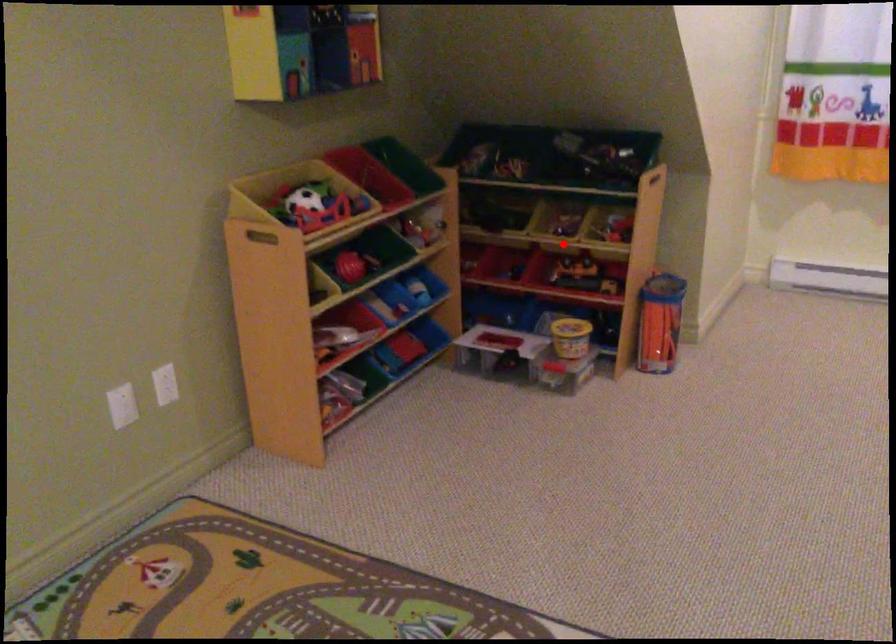
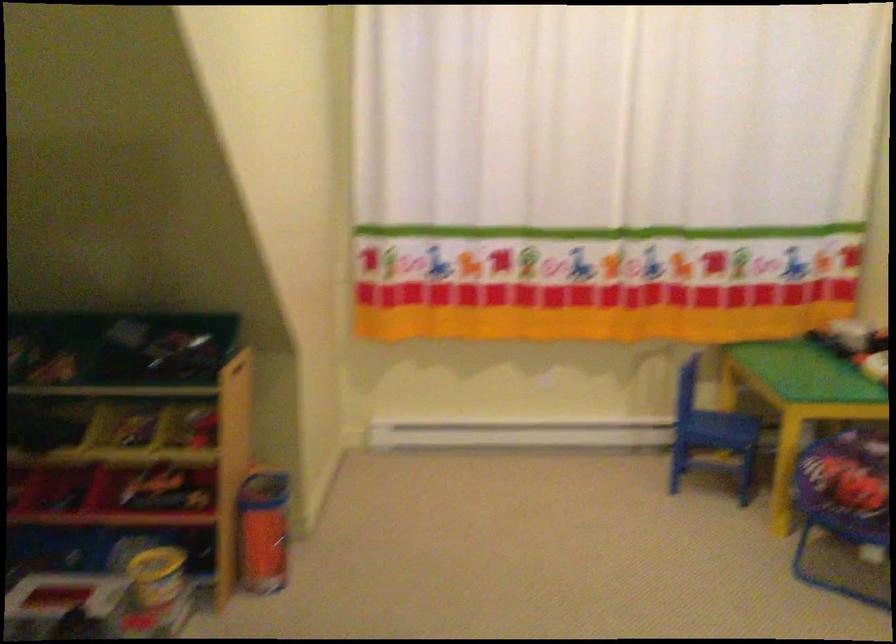
Question: I am providing you with two images of the same scene from different viewpoints. Image1 has a red point marked. In image2, the corresponding 3D location appears at what relative position? Reply with the corresponding letter.

Choices:
 (A) Closer
 (B) Farther

Answer: (A)